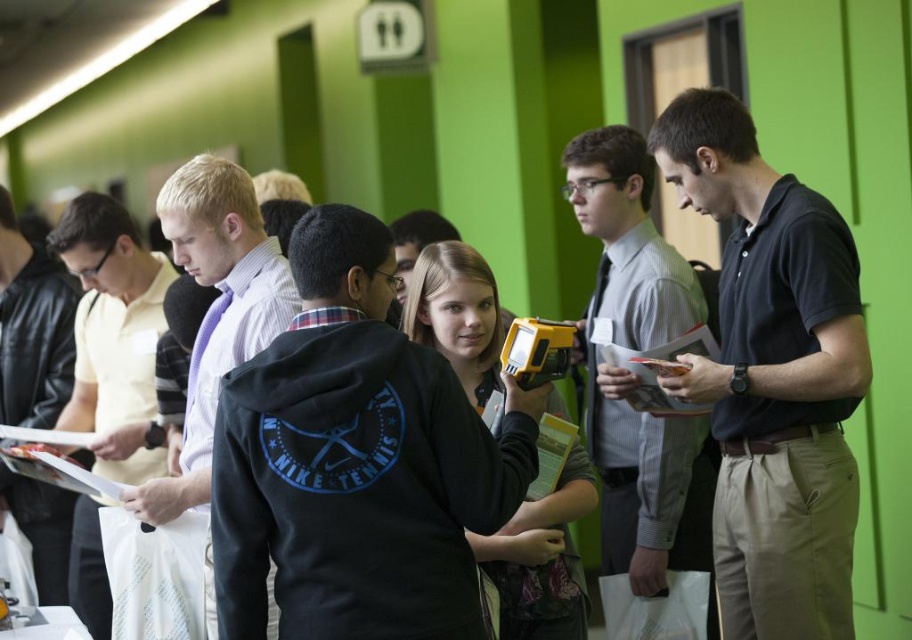
You are standing in the room with the bright green walls and need to move from the point at coordinates point (x=568, y=170) to the point at coordinates point (x=17, y=390). Is the destination point closer to you or further away compared to your starting position?

The point at coordinates point (x=17, y=390) is further away from you than the starting point at point (x=568, y=170) because the description states that point (x=568, y=170) is in front of point (x=17, y=390).

You are standing in the room and want to reach both the point at coordinates [728,548] and the point at coordinates [29,298]. Which point should you approach first to reach the closer one first?

Point [728,548] is closer to you than point [29,298], so you should approach point [728,548] first.